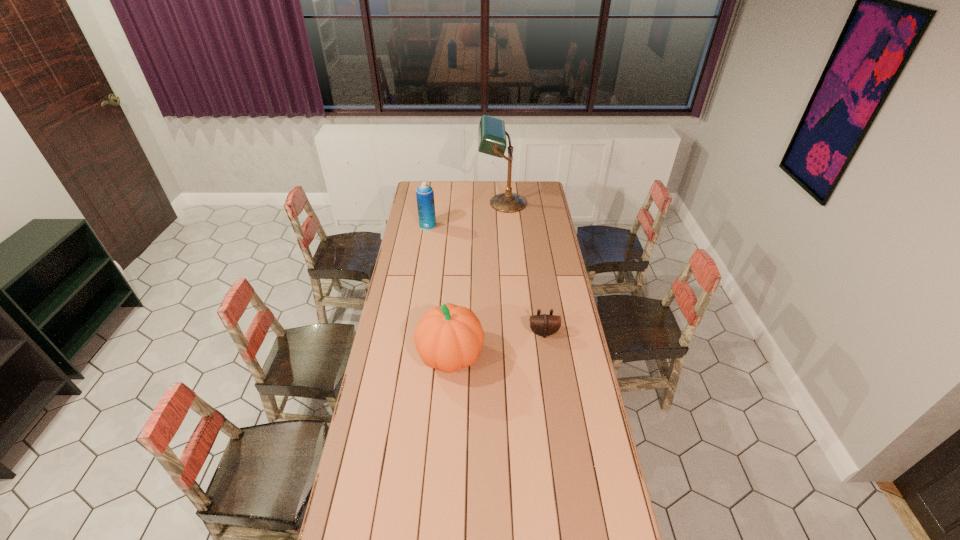
The image size is (960, 540). What are the coordinates of `object positioned at the far edge` in the screenshot? It's located at (491, 132).

The width and height of the screenshot is (960, 540). In order to click on object located in the left edge section of the desktop in this screenshot , I will do `click(424, 193)`.

At what (x,y) coordinates should I click in order to perform the action: click on table lamp that is positioned at the right edge. Please return your answer as a coordinate pair (x, y). Image resolution: width=960 pixels, height=540 pixels. Looking at the image, I should click on (491, 132).

Find the location of a particular element. This screenshot has width=960, height=540. pouch that is positioned at the right edge is located at coordinates (544, 325).

Image resolution: width=960 pixels, height=540 pixels. I want to click on object that is positioned at the far right corner, so click(491, 132).

In the image, there is a desktop. Identify the location of free space at the far edge. (475, 197).

The image size is (960, 540). What are the coordinates of `vacant area at the left edge` in the screenshot? It's located at (425, 246).

Where is `vacant space at the right edge of the desktop`? vacant space at the right edge of the desktop is located at coordinates (537, 249).

In the image, there is a desktop. Identify the location of vacant space at the far left corner. (435, 197).

Where is `vacant space that's between the shortest object and the pumpkin`? vacant space that's between the shortest object and the pumpkin is located at coordinates (497, 345).